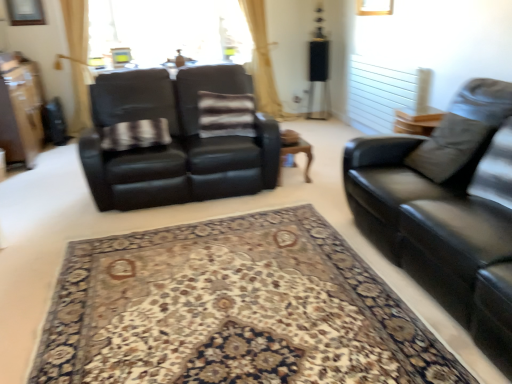
Question: Considering the relative sizes of black leather couch at left, the second studio couch from the right, and wooden coffee table at center in the image provided, is black leather couch at left, the second studio couch from the right, taller than wooden coffee table at center?

Choices:
 (A) no
 (B) yes

Answer: (B)

Question: Is black leather couch at left, acting as the second studio couch starting from the front, next to wooden coffee table at center and touching it?

Choices:
 (A) no
 (B) yes

Answer: (A)

Question: Considering the relative positions of black leather couch at left, which is counted as the 1th studio couch, starting from the back, and wooden coffee table at center in the image provided, is black leather couch at left, which is counted as the 1th studio couch, starting from the back, to the right of wooden coffee table at center from the viewer's perspective?

Choices:
 (A) yes
 (B) no

Answer: (B)

Question: Could wooden coffee table at center be considered to be inside black leather couch at left, the second studio couch from the right?

Choices:
 (A) no
 (B) yes

Answer: (A)

Question: From a real-world perspective, is black leather couch at left, the second studio couch from the right, on wooden coffee table at center?

Choices:
 (A) no
 (B) yes

Answer: (B)

Question: From their relative heights in the image, would you say wooden coffee table at center is taller or shorter than carpeted rug at center?

Choices:
 (A) tall
 (B) short

Answer: (A)

Question: Is wooden coffee table at center inside the boundaries of carpeted rug at center, or outside?

Choices:
 (A) inside
 (B) outside

Answer: (B)

Question: Does point (306, 165) appear closer or farther from the camera than point (297, 230)?

Choices:
 (A) farther
 (B) closer

Answer: (A)

Question: From a real-world perspective, is wooden coffee table at center physically located above or below carpeted rug at center?

Choices:
 (A) below
 (B) above

Answer: (B)

Question: Is matte brown dresser at left situated inside wooden coffee table at center or outside?

Choices:
 (A) inside
 (B) outside

Answer: (B)

Question: From the image's perspective, is matte brown dresser at left located above or below wooden coffee table at center?

Choices:
 (A) below
 (B) above

Answer: (B)

Question: In the image, is matte brown dresser at left positioned in front of or behind wooden coffee table at center?

Choices:
 (A) behind
 (B) front

Answer: (A)

Question: In the image, is matte brown dresser at left on the left side or the right side of wooden coffee table at center?

Choices:
 (A) right
 (B) left

Answer: (B)

Question: Is black leather couch at right, which is counted as the 2th studio couch, starting from the left, wider or thinner than transparent glass window screen at upper center?

Choices:
 (A) thin
 (B) wide

Answer: (B)

Question: From their relative heights in the image, would you say black leather couch at right, the 1th studio couch positioned from the right, is taller or shorter than transparent glass window screen at upper center?

Choices:
 (A) tall
 (B) short

Answer: (A)